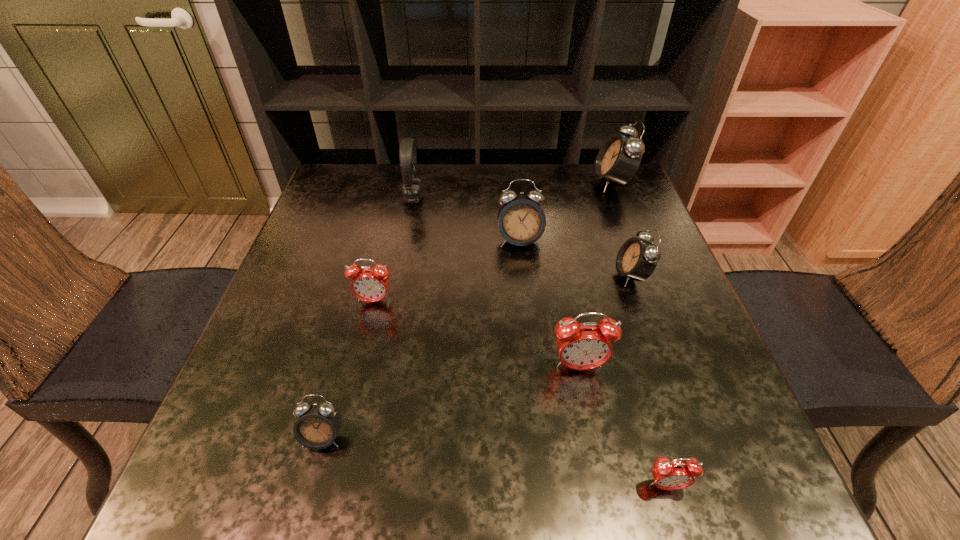
The width and height of the screenshot is (960, 540). In order to click on free space located on the face of the biggest red alarm clock in this screenshot , I will do [596, 458].

This screenshot has height=540, width=960. Identify the location of free space located on the face of the fourth farthest object. (460, 275).

The height and width of the screenshot is (540, 960). I want to click on blank area located 0.390m on the face of the fourth farthest object, so click(442, 275).

Identify the location of blank space located on the face of the fourth farthest object. (517, 275).

At what (x,y) coordinates should I click in order to perform the action: click on free space located 0.150m on the face of the second smallest red alarm clock. Please return your answer as a coordinate pair (x, y). This screenshot has width=960, height=540. Looking at the image, I should click on (358, 367).

Image resolution: width=960 pixels, height=540 pixels. In order to click on vacant region located on the face of the smallest white alarm clock in this screenshot , I will do `click(310, 486)`.

Find the location of a particular element. Image resolution: width=960 pixels, height=540 pixels. alarm clock positioned at the far edge is located at coordinates (619, 157).

Image resolution: width=960 pixels, height=540 pixels. In order to click on headset located in the far edge section of the desktop in this screenshot , I will do [x=412, y=190].

Find the location of a particular element. The height and width of the screenshot is (540, 960). object located at the left edge is located at coordinates (318, 423).

Where is `object located at the near left corner`? This screenshot has height=540, width=960. object located at the near left corner is located at coordinates (318, 423).